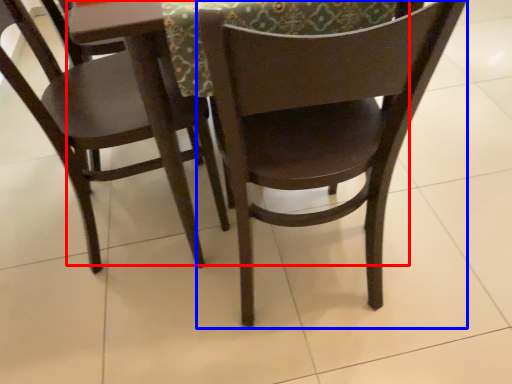
Question: Which of the following is the farthest to the observer, round table (highlighted by a red box) or chair (highlighted by a blue box)?

Choices:
 (A) round table
 (B) chair

Answer: (A)